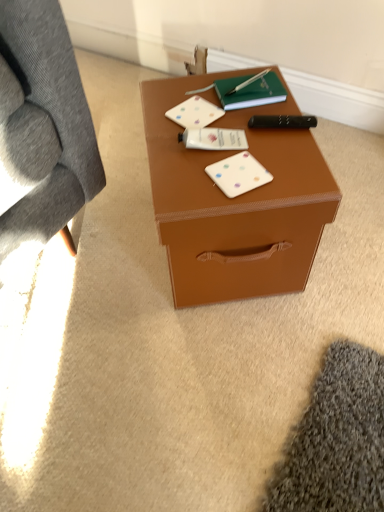
Locate an element on the screen. The height and width of the screenshot is (512, 384). vacant space behind black plastic remote control at right is located at coordinates (259, 108).